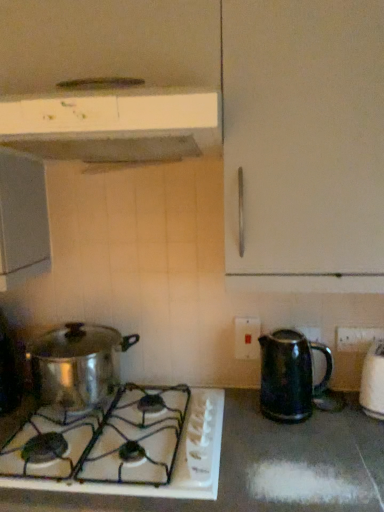
Find the location of a particular element. Image resolution: width=384 pixels, height=512 pixels. free space to the left of shiny metallic kettle at right, marked as the 3th kitchen appliance in a top-to-bottom arrangement is located at coordinates (241, 413).